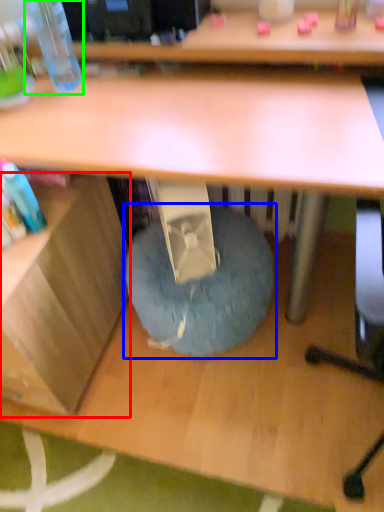
Question: Which is nearer to the shelf (highlighted by a red box)? bean bag chair (highlighted by a blue box) or bottle (highlighted by a green box).

Choices:
 (A) bean bag chair
 (B) bottle

Answer: (A)